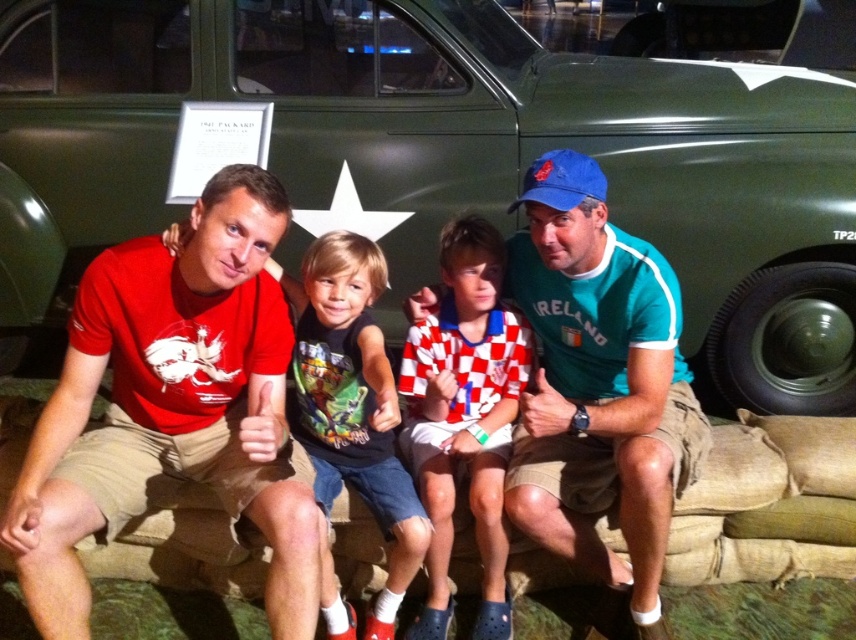
Question: From the image, what is the correct spatial relationship of green matte car at upper center in relation to green printed t-shirt at center?

Choices:
 (A) below
 (B) above

Answer: (B)

Question: Which is nearer to the green printed t-shirt at center?

Choices:
 (A) teal fabric shirt at center
 (B) matte red t-shirt at left
 (C) green matte car at upper center

Answer: (B)

Question: From the image, what is the correct spatial relationship of matte red t-shirt at center in relation to matte red t-shirt at left?

Choices:
 (A) right
 (B) left

Answer: (A)

Question: Considering the real-world distances, which object is closest to the red and white checkered shirt at center?

Choices:
 (A) matte red t-shirt at center
 (B) teal fabric shirt at center
 (C) matte red t-shirt at left
 (D) green matte car at upper center

Answer: (B)

Question: Does green matte car at upper center appear over matte red t-shirt at center?

Choices:
 (A) yes
 (B) no

Answer: (A)

Question: Which is nearer to the red and white checkered shirt at center?

Choices:
 (A) matte red t-shirt at left
 (B) green printed t-shirt at center
 (C) matte red t-shirt at center
 (D) teal fabric shirt at center

Answer: (B)